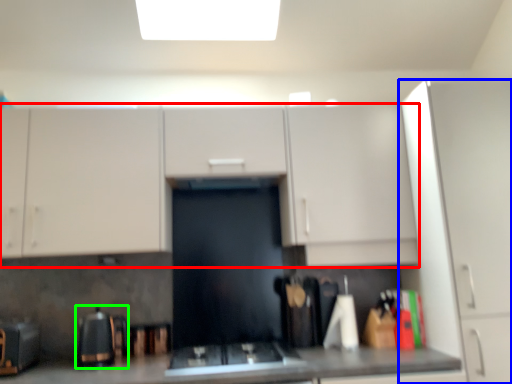
Question: Which is farther away from cabinetry (highlighted by a red box)? cabinetry (highlighted by a blue box) or appliance (highlighted by a green box)?

Choices:
 (A) cabinetry
 (B) appliance

Answer: (B)